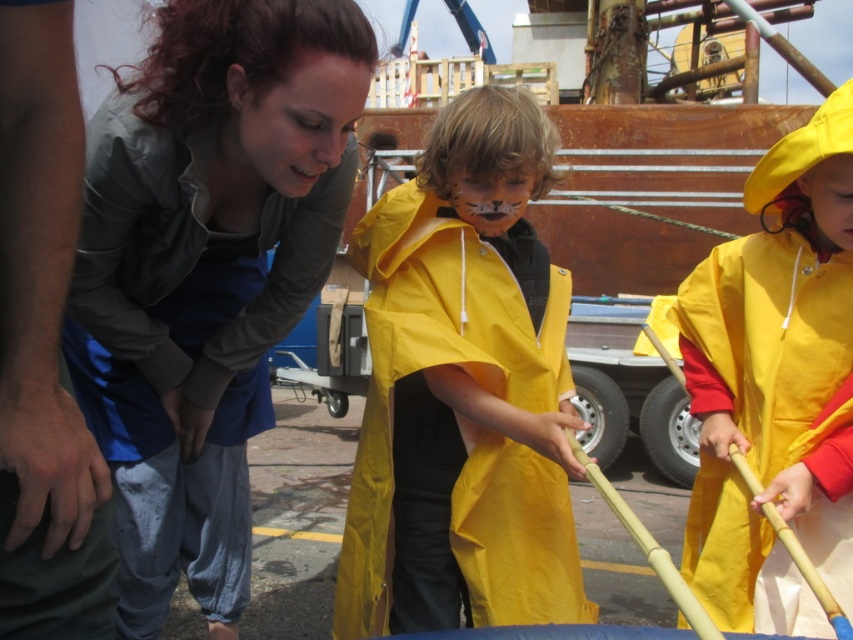
What are the coordinates of the matte gray jacket at upper left?

The coordinates of the matte gray jacket at upper left are at point (206, 273).

You are a photographer trying to capture a photo of the two people wearing the matte gray jacket at upper left and the yellow matte raincoat at right. Which person should you focus on first if you want to include both in the frame without moving the camera?

The matte gray jacket at upper left is taller than the yellow matte raincoat at right, so you should focus on the matte gray jacket at upper left first to ensure both are in frame.